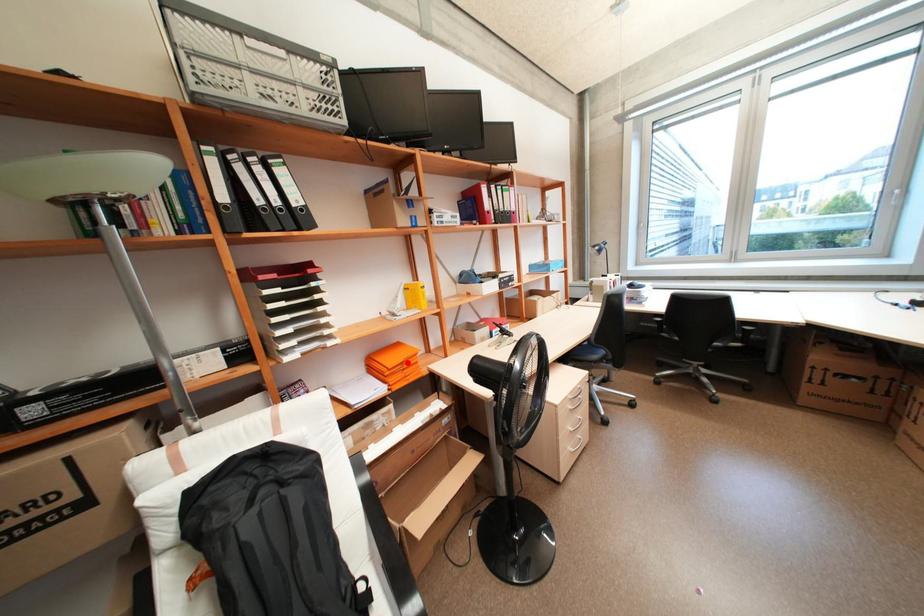
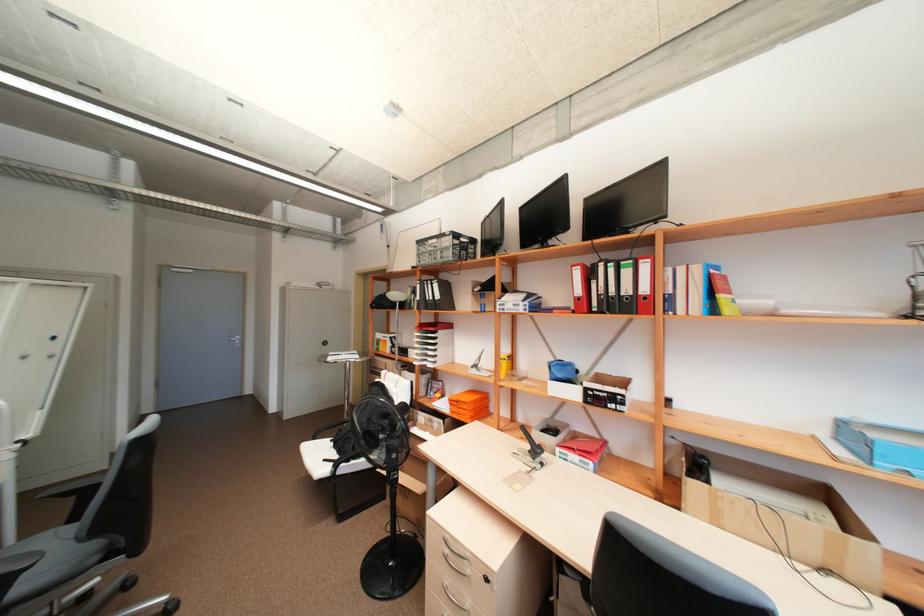
Question: I am providing you with two images of the same scene from different viewpoints. Given a red point in image1, look at the same physical point in image2. Is it:

Choices:
 (A) Closer to the viewpoint
 (B) Farther from the viewpoint

Answer: (B)